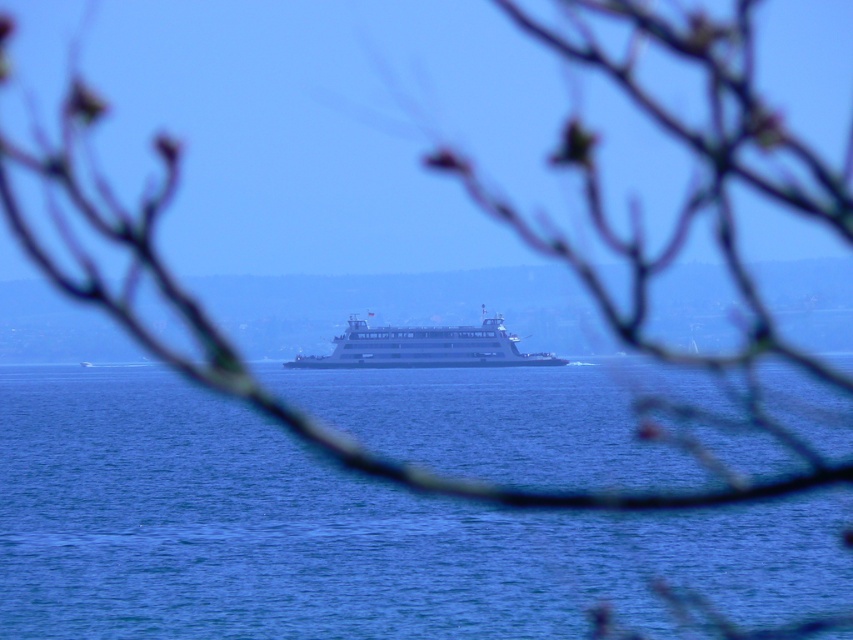
Is blue water at center bigger than white glossy ferry at center?

Yes, blue water at center is bigger than white glossy ferry at center.

Does blue water at center have a smaller size compared to white glossy ferry at center?

No, blue water at center is not smaller than white glossy ferry at center.

Between point (32, 634) and point (294, 365), which one is positioned in front?

Point (32, 634) is in front.

I want to click on blue water at center, so click(x=335, y=534).